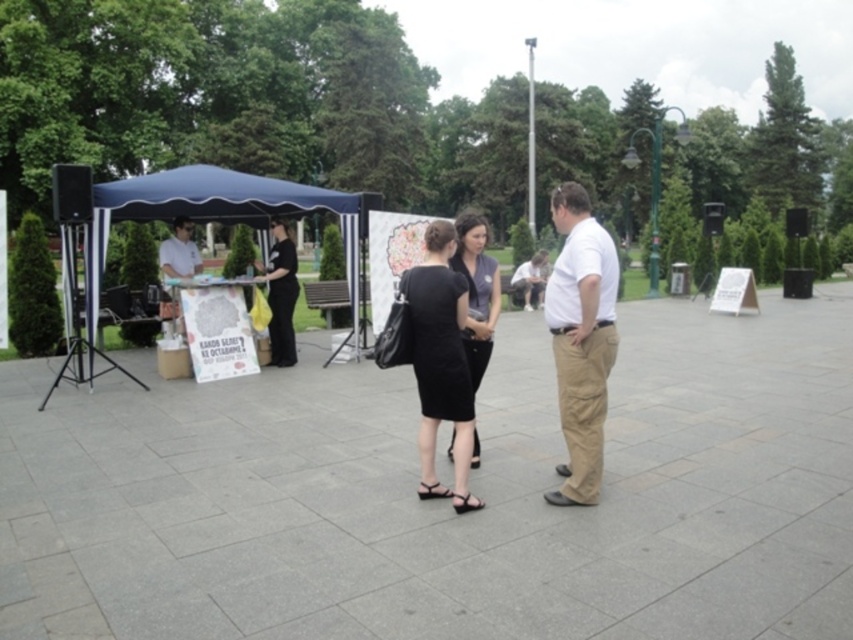
What do you see at coordinates (581, 339) in the screenshot? I see `white cotton shirt at center` at bounding box center [581, 339].

The height and width of the screenshot is (640, 853). I want to click on white cotton shirt at center, so click(581, 339).

This screenshot has height=640, width=853. What are the coordinates of `white cotton shirt at center` in the screenshot? It's located at (581, 339).

Which is in front, point (596, 300) or point (430, 244)?

Point (596, 300) is in front.

Between white cotton shirt at center and black matte dress at center, which one appears on the right side from the viewer's perspective?

white cotton shirt at center

Is point (606, 376) in front of point (430, 496)?

Yes, it is in front of point (430, 496).

What are the coordinates of `white cotton shirt at center` in the screenshot? It's located at (581, 339).

Between black fabric umbrella at upper center and white shirt at center, which one appears on the right side from the viewer's perspective?

black fabric umbrella at upper center is more to the right.

Does black fabric umbrella at upper center appear on the right side of white shirt at center?

Indeed, black fabric umbrella at upper center is positioned on the right side of white shirt at center.

Who is more forward, (271, 246) or (158, 248)?

Point (271, 246)

Find the location of a particular element. This screenshot has width=853, height=640. black fabric umbrella at upper center is located at coordinates (280, 294).